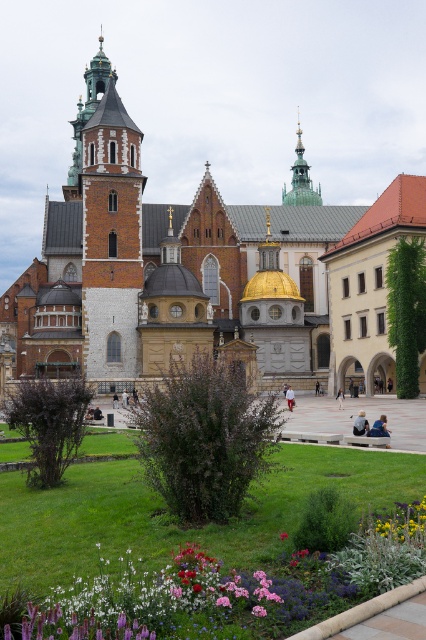
Does green metallic spire at upper center have a lesser height compared to light blue denim jacket at center?

No, green metallic spire at upper center is not shorter than light blue denim jacket at center.

Is green metallic spire at upper center further to camera compared to light blue denim jacket at center?

Yes, green metallic spire at upper center is behind light blue denim jacket at center.

Find the location of `green metallic spire at upper center`. green metallic spire at upper center is located at coordinates (301, 179).

Can you confirm if green metallic spire at upper center is shorter than blue denim jacket at lower right?

Incorrect, green metallic spire at upper center's height does not fall short of blue denim jacket at lower right's.

Can you confirm if green metallic spire at upper center is positioned above blue denim jacket at lower right?

Indeed, green metallic spire at upper center is positioned over blue denim jacket at lower right.

Which is in front, point (302, 196) or point (356, 429)?

Point (356, 429) is in front.

The image size is (426, 640). I want to click on green metallic spire at upper center, so click(301, 179).

Measure the distance from yellow-green textured flower at lower right to green metallic spire at upper center.

yellow-green textured flower at lower right and green metallic spire at upper center are 368.71 feet apart from each other.

Which is in front, point (383, 536) or point (296, 195)?

Point (383, 536) is in front.

Image resolution: width=426 pixels, height=640 pixels. Identify the location of yellow-green textured flower at lower right. (397, 524).

Locate an element on the screen. This screenshot has height=640, width=426. yellow-green textured flower at lower right is located at coordinates click(x=397, y=524).